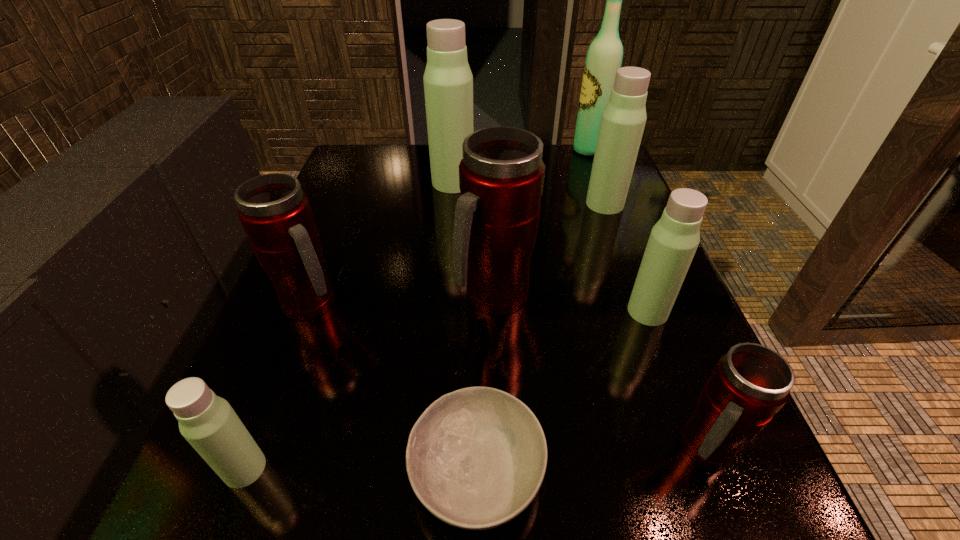
I want to click on vacant position at the left edge of the desktop, so click(x=373, y=257).

Where is `free space at the right edge of the desktop`? Image resolution: width=960 pixels, height=540 pixels. free space at the right edge of the desktop is located at coordinates (591, 251).

I want to click on free space at the far left corner, so click(x=364, y=154).

Where is `vacant space at the near right corner of the desktop`? vacant space at the near right corner of the desktop is located at coordinates (698, 512).

Find the location of a particular element. The image size is (960, 540). blank region between the nearest light thermos bottle and the second biggest light thermos bottle is located at coordinates (424, 336).

Image resolution: width=960 pixels, height=540 pixels. Find the location of `empty location between the tallest thermos bottle and the rightmost red thermos bottle`. empty location between the tallest thermos bottle and the rightmost red thermos bottle is located at coordinates (x=579, y=315).

Identify the location of unoccupied position between the second biggest red thermos bottle and the nearest light thermos bottle. (278, 386).

Identify the location of unoccupied area between the third light thermos bottle from right to left and the smallest red thermos bottle. The width and height of the screenshot is (960, 540). (579, 315).

Identify which object is the second nearest to the biggest red thermos bottle. Please provide its 2D coordinates. Your answer should be formatted as a tuple, i.e. [(x, y)], where the tuple contains the x and y coordinates of a point satisfying the conditions above.

[(673, 241)]

Select which object appears as the fifth closest to the second smallest light thermos bottle. Please provide its 2D coordinates. Your answer should be formatted as a tuple, i.e. [(x, y)], where the tuple contains the x and y coordinates of a point satisfying the conditions above.

[(448, 81)]